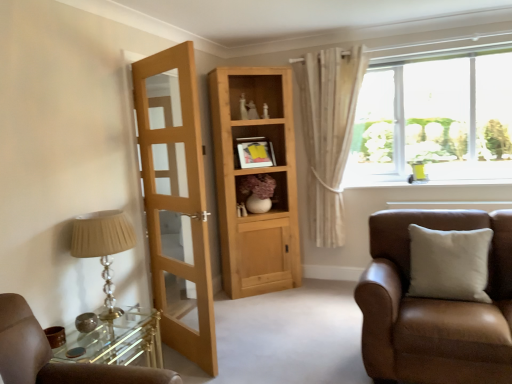
Question: Is natural wood cabinet at center outside of matte black picture frame at center?

Choices:
 (A) no
 (B) yes

Answer: (B)

Question: Does natural wood cabinet at center have a lesser width compared to matte black picture frame at center?

Choices:
 (A) no
 (B) yes

Answer: (A)

Question: From a real-world perspective, is natural wood cabinet at center physically above matte black picture frame at center?

Choices:
 (A) no
 (B) yes

Answer: (A)

Question: Does natural wood cabinet at center have a greater height compared to matte black picture frame at center?

Choices:
 (A) yes
 (B) no

Answer: (A)

Question: Can you confirm if natural wood cabinet at center is positioned to the right of matte black picture frame at center?

Choices:
 (A) yes
 (B) no

Answer: (B)

Question: From a real-world perspective, is natural wood cabinet at center located beneath matte black picture frame at center?

Choices:
 (A) yes
 (B) no

Answer: (A)

Question: Is white glossy window sill at upper right aimed at white textured curtain at upper right?

Choices:
 (A) no
 (B) yes

Answer: (A)

Question: Can you confirm if white glossy window sill at upper right is positioned to the right of white textured curtain at upper right?

Choices:
 (A) yes
 (B) no

Answer: (A)

Question: Is white glossy window sill at upper right bigger than white textured curtain at upper right?

Choices:
 (A) no
 (B) yes

Answer: (A)

Question: Is white glossy window sill at upper right looking in the opposite direction of white textured curtain at upper right?

Choices:
 (A) no
 (B) yes

Answer: (A)

Question: From a real-world perspective, is white glossy window sill at upper right located higher than white textured curtain at upper right?

Choices:
 (A) yes
 (B) no

Answer: (B)

Question: Is white glossy window sill at upper right taller than white textured curtain at upper right?

Choices:
 (A) no
 (B) yes

Answer: (A)

Question: From a real-world perspective, is light brown wooden door at left located beneath white glossy window sill at upper right?

Choices:
 (A) no
 (B) yes

Answer: (A)